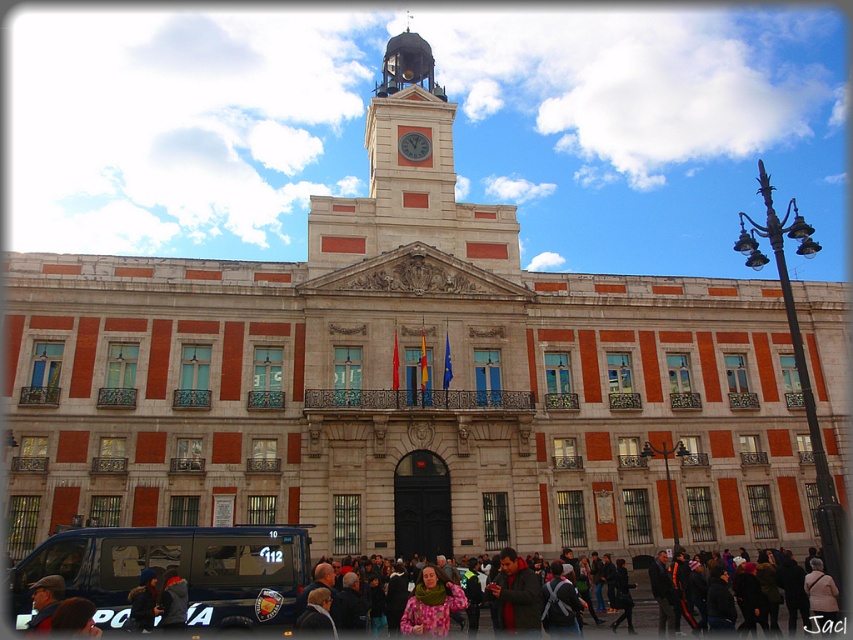
Who is more distant from viewer, (x=434, y=632) or (x=426, y=150)?

The point (x=426, y=150) is more distant.

Which of these two, floral fabric scarf at center or metallic clock face at center, stands shorter?

floral fabric scarf at center

What do you see at coordinates (431, 604) in the screenshot? I see `floral fabric scarf at center` at bounding box center [431, 604].

Identify the location of floral fabric scarf at center. The image size is (853, 640). (431, 604).

Who is taller, polished bronze clock tower at center or floral fabric scarf at center?

polished bronze clock tower at center

Which of these two, polished bronze clock tower at center or floral fabric scarf at center, stands shorter?

With less height is floral fabric scarf at center.

Between point (503, 228) and point (450, 579), which one is positioned in front?

Positioned in front is point (450, 579).

In order to click on polished bronze clock tower at center in this screenshot , I will do `click(409, 180)`.

Is polished bronze clock tower at center above metallic clock face at center?

Yes.

Who is shorter, polished bronze clock tower at center or metallic clock face at center?

With less height is metallic clock face at center.

Measure the distance between point (361, 208) and camera.

Point (361, 208) is 65.32 meters away from camera.

The image size is (853, 640). I want to click on polished bronze clock tower at center, so click(409, 180).